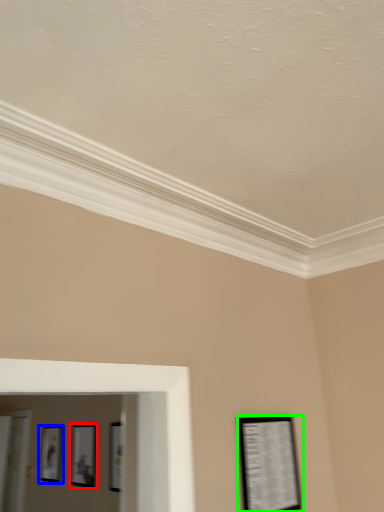
Question: Based on their relative distances, which object is farther from picture frame (highlighted by a red box)? Choose from picture frame (highlighted by a blue box) and picture frame (highlighted by a green box).

Choices:
 (A) picture frame
 (B) picture frame

Answer: (B)